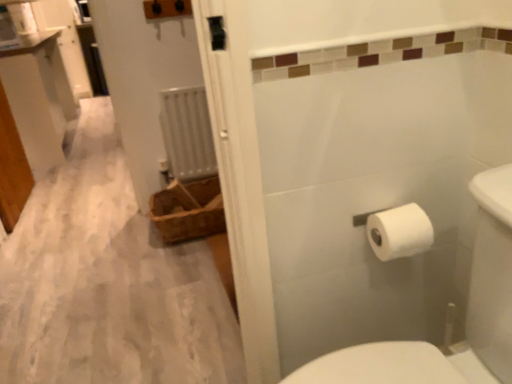
Question: Can you confirm if white matte toilet paper at right is taller than white paper towel at right?

Choices:
 (A) yes
 (B) no

Answer: (B)

Question: Could white paper towel at right be considered to be inside white matte toilet paper at right?

Choices:
 (A) no
 (B) yes

Answer: (A)

Question: Does white matte toilet paper at right appear on the left side of white paper towel at right?

Choices:
 (A) yes
 (B) no

Answer: (B)

Question: Is white matte toilet paper at right located outside white paper towel at right?

Choices:
 (A) no
 (B) yes

Answer: (B)

Question: Is white matte toilet paper at right wider than white paper towel at right?

Choices:
 (A) no
 (B) yes

Answer: (A)

Question: Is white matte toilet paper at right smaller than white paper towel at right?

Choices:
 (A) no
 (B) yes

Answer: (B)

Question: Is white metallic radiator at center not within brown woven basket at left?

Choices:
 (A) no
 (B) yes

Answer: (B)

Question: Does white metallic radiator at center have a lesser height compared to brown woven basket at left?

Choices:
 (A) yes
 (B) no

Answer: (B)

Question: Is brown woven basket at left surrounded by white metallic radiator at center?

Choices:
 (A) yes
 (B) no

Answer: (B)

Question: From the image's perspective, does white metallic radiator at center appear higher than brown woven basket at left?

Choices:
 (A) no
 (B) yes

Answer: (B)

Question: Does white metallic radiator at center have a larger size compared to brown woven basket at left?

Choices:
 (A) no
 (B) yes

Answer: (A)

Question: From the image's perspective, would you say white metallic radiator at center is shown under brown woven basket at left?

Choices:
 (A) yes
 (B) no

Answer: (B)

Question: Can you confirm if white matte toilet paper at right is bigger than white glossy vanity at upper left?

Choices:
 (A) no
 (B) yes

Answer: (A)